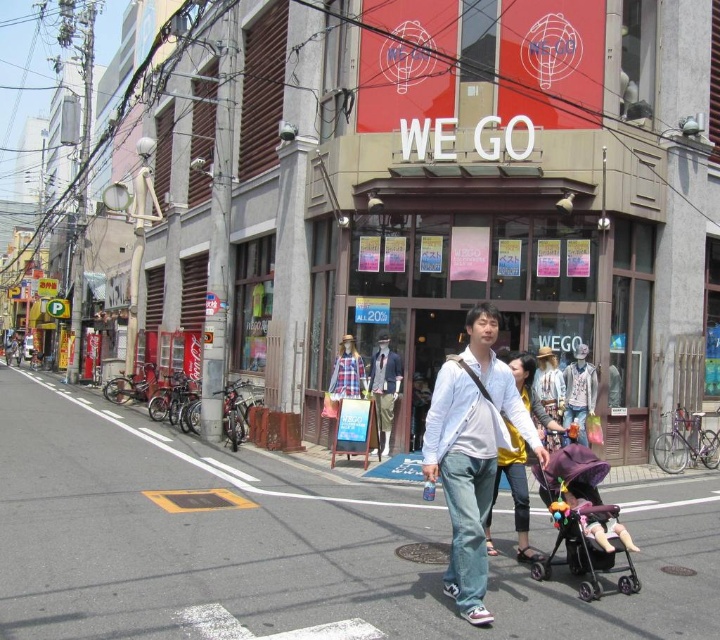
You are standing on the street in front of the WE GO store. You want to take a photo of the building with your phone, which has a maximum zoom range of 5 meters. Can you zoom in on the point at coordinates point [549,426] without moving closer?

The point at coordinates point [549,426] is 6.63 meters away from you. Since your phone has a maximum zoom range of 5 meters, you cannot zoom in on the point without moving closer.

You are a customer in the store and want to hang both the light yellow fabric dress at center and the denim jacket at center on a single hanger. The hanger can only hold items up to 1.2 meters in height. Can both items fit on the hanger together?

The light yellow fabric dress at center is taller than the denim jacket at center. However, since the exact heights are not provided, we cannot determine if their combined height exceeds the hanger limit of 1.2 meters. Additional measurements are needed.